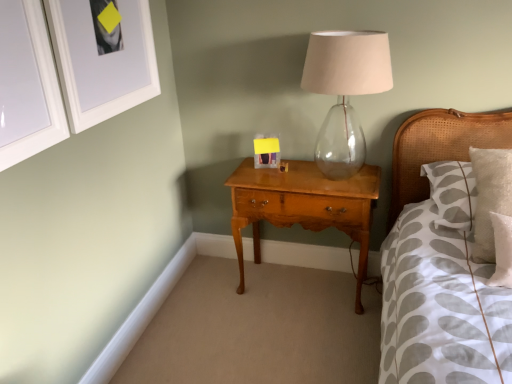
Question: From the image's perspective, would you say shiny brown wood nightstand at center is shown under matte plastic picture frame at center, marked as the 3th picture frame in a front-to-back arrangement?

Choices:
 (A) no
 (B) yes

Answer: (B)

Question: Is shiny brown wood nightstand at center facing towards matte plastic picture frame at center, which is the 1th picture frame from right to left?

Choices:
 (A) yes
 (B) no

Answer: (B)

Question: Is shiny brown wood nightstand at center shorter than matte plastic picture frame at center, which is the 1th picture frame from right to left?

Choices:
 (A) no
 (B) yes

Answer: (A)

Question: Is shiny brown wood nightstand at center oriented away from matte plastic picture frame at center, marked as the 1th picture frame in a back-to-front arrangement?

Choices:
 (A) yes
 (B) no

Answer: (B)

Question: Can you confirm if shiny brown wood nightstand at center is wider than matte plastic picture frame at center, which is the 1th picture frame from right to left?

Choices:
 (A) no
 (B) yes

Answer: (B)

Question: Is shiny brown wood nightstand at center inside or outside of white matte picture frame at upper left, acting as the second picture frame starting from the left?

Choices:
 (A) inside
 (B) outside

Answer: (B)

Question: Based on their positions, is shiny brown wood nightstand at center located to the left or right of white matte picture frame at upper left, acting as the second picture frame starting from the left?

Choices:
 (A) left
 (B) right

Answer: (B)

Question: From a real-world perspective, is shiny brown wood nightstand at center above or below white matte picture frame at upper left, acting as the second picture frame starting from the left?

Choices:
 (A) below
 (B) above

Answer: (A)

Question: Looking at their shapes, would you say shiny brown wood nightstand at center is wider or thinner than white matte picture frame at upper left, the second picture frame when ordered from right to left?

Choices:
 (A) wide
 (B) thin

Answer: (A)

Question: Is woven cane headboard at right inside the boundaries of white matte picture frame at upper left, arranged as the 2th picture frame when viewed from the front, or outside?

Choices:
 (A) inside
 (B) outside

Answer: (B)

Question: Is woven cane headboard at right bigger or smaller than white matte picture frame at upper left, acting as the second picture frame starting from the left?

Choices:
 (A) big
 (B) small

Answer: (A)

Question: In terms of width, does woven cane headboard at right look wider or thinner when compared to white matte picture frame at upper left, arranged as the 2th picture frame when viewed from the front?

Choices:
 (A) thin
 (B) wide

Answer: (B)

Question: Visually, is woven cane headboard at right positioned to the left or to the right of white matte picture frame at upper left, the second picture frame from the back?

Choices:
 (A) left
 (B) right

Answer: (B)

Question: Looking at the image, does matte plastic picture frame at center, marked as the 3th picture frame in a front-to-back arrangement, seem bigger or smaller compared to woven cane headboard at right?

Choices:
 (A) big
 (B) small

Answer: (B)

Question: Relative to woven cane headboard at right, is matte plastic picture frame at center, marked as the 3th picture frame in a front-to-back arrangement, in front or behind?

Choices:
 (A) front
 (B) behind

Answer: (B)